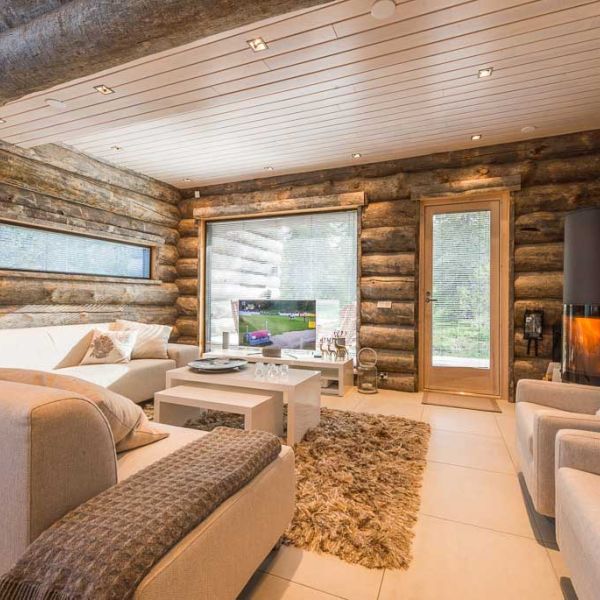
Find the location of `2 decorative pieces`. 2 decorative pieces is located at coordinates (340, 348), (208, 359).